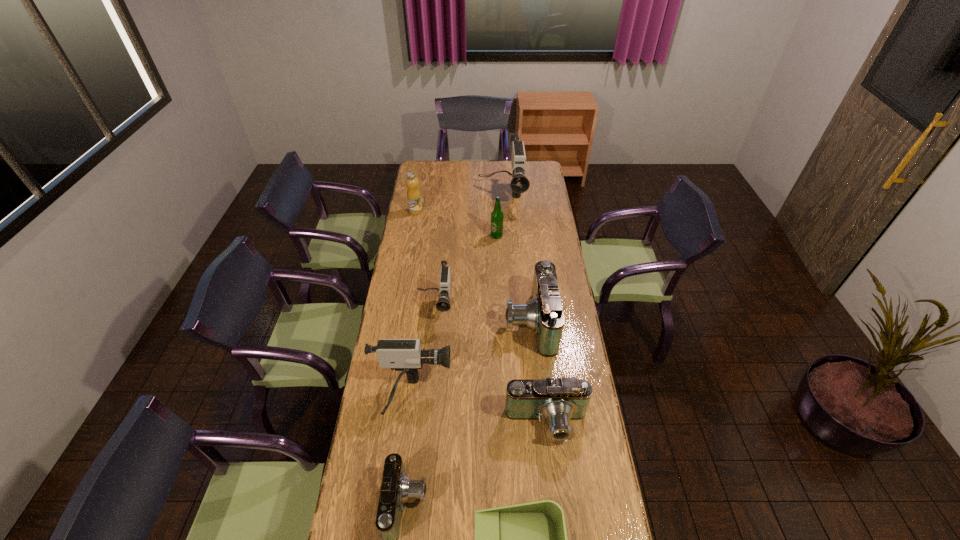
At what (x,y) coordinates should I click in order to perform the action: click on object situated at the far right corner. Please return your answer as a coordinate pair (x, y). This screenshot has height=540, width=960. Looking at the image, I should click on (519, 184).

Where is `vacant space at the left edge of the desktop`? The width and height of the screenshot is (960, 540). vacant space at the left edge of the desktop is located at coordinates (422, 300).

At what (x,y) coordinates should I click in order to perform the action: click on free space at the right edge. Please return your answer as a coordinate pair (x, y). This screenshot has height=540, width=960. Looking at the image, I should click on (530, 200).

Locate an element on the screen. This screenshot has width=960, height=540. vacant space that is in between the third farthest object and the second farthest blue camcorder is located at coordinates (521, 330).

Where is `free space between the nearest white camcorder and the third farthest object`? The image size is (960, 540). free space between the nearest white camcorder and the third farthest object is located at coordinates (454, 316).

Locate an element on the screen. The image size is (960, 540). empty location between the seventh nearest object and the second biggest blue camcorder is located at coordinates (521, 330).

You are a GUI agent. You are given a task and a screenshot of the screen. Output one action in this format:
    pyautogui.click(x=<x>, y=<y>)
    Task: Click on the free point between the rightmost white camcorder and the fruit juice
    
    Given the screenshot: What is the action you would take?
    pyautogui.click(x=459, y=204)

Identify the location of empty space that is in between the second biggest white camcorder and the farthest blue camcorder. (470, 359).

Locate an element on the screen. Image resolution: width=960 pixels, height=540 pixels. the third closest object to the fruit juice is located at coordinates (443, 304).

This screenshot has height=540, width=960. What are the coordinates of `object identified as the fourth closest to the biggest white camcorder` in the screenshot? It's located at pyautogui.click(x=543, y=314).